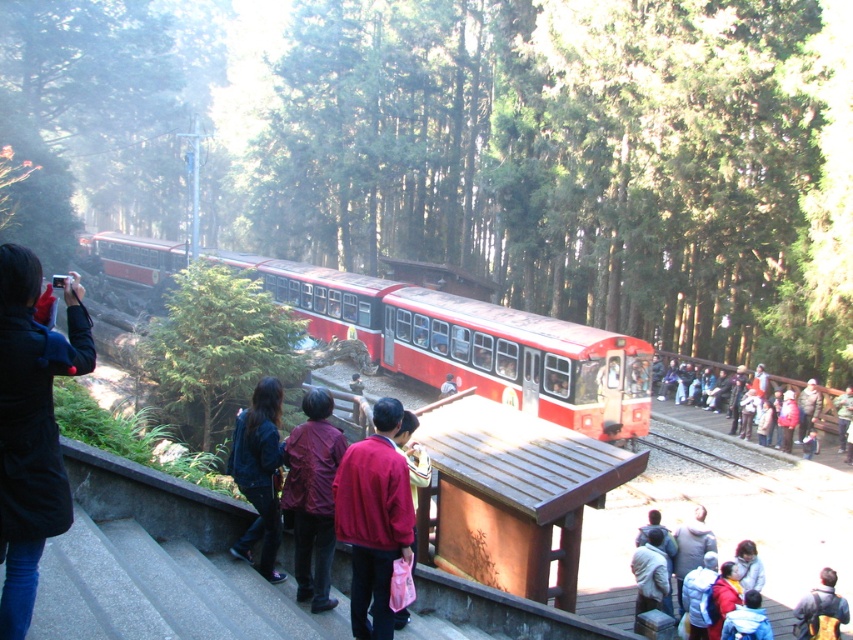
Is point (306, 486) positioned after point (677, 541)?

No, (306, 486) is in front of (677, 541).

Is point (305, 438) in front of point (677, 547)?

Yes, it is.

You are a GUI agent. You are given a task and a screenshot of the screen. Output one action in this format:
    pyautogui.click(x=<x>, y=<y>)
    Task: Click on the maroon fabric coat at center
    This screenshot has width=853, height=640.
    Given the screenshot: What is the action you would take?
    pyautogui.click(x=312, y=497)

Is red matte train at center taller than denim jacket at lower left?

Indeed, red matte train at center has a greater height compared to denim jacket at lower left.

Locate an element on the screen. The width and height of the screenshot is (853, 640). red matte train at center is located at coordinates (471, 344).

Where is `red matte train at center`? Image resolution: width=853 pixels, height=640 pixels. red matte train at center is located at coordinates (471, 344).

Is denim jacket at lower left shorter than dark blue jacket at lower right?

Incorrect, denim jacket at lower left's height does not fall short of dark blue jacket at lower right's.

How much distance is there between denim jacket at lower left and dark blue jacket at lower right?

The distance of denim jacket at lower left from dark blue jacket at lower right is 20.62 feet.

Who is more distant from viewer, (270, 532) or (799, 634)?

Point (799, 634)

Locate an element on the screen. This screenshot has width=853, height=640. denim jacket at lower left is located at coordinates (259, 474).